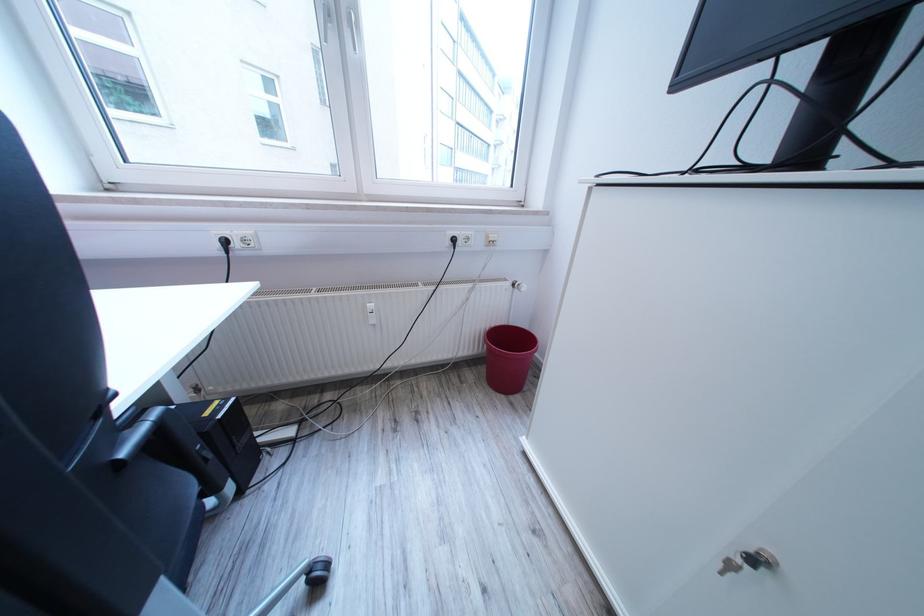
Where would you turn the white window handle? Please return your answer as a coordinate pair (x, y).

(353, 26)